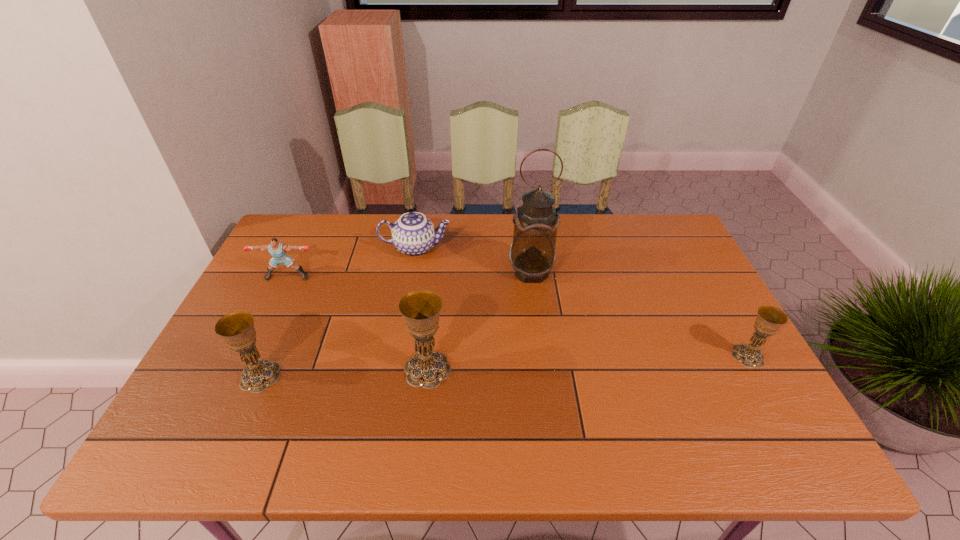
Locate an element on the screen. Image resolution: width=960 pixels, height=540 pixels. free space that is in between the second tallest object and the leftmost chalice is located at coordinates (344, 373).

I want to click on unoccupied area between the tallest object and the tallest chalice, so click(x=479, y=320).

Find the location of a particular element. free spot between the second chalice from right to left and the rightmost object is located at coordinates (588, 362).

Identify the location of unoccupied position between the second object from right to left and the second tallest object. (479, 320).

Identify the location of vacant space in between the puncher and the tallest object. The width and height of the screenshot is (960, 540). (409, 274).

In order to click on unoccupied position between the fifth object from left to right and the shortest chalice in this screenshot , I will do `click(639, 314)`.

Image resolution: width=960 pixels, height=540 pixels. Find the location of `unoccupied position between the leftmost chalice and the chinaware`. unoccupied position between the leftmost chalice and the chinaware is located at coordinates (338, 312).

In order to click on object that stands as the fourth closest to the chinaware in this screenshot , I will do `click(237, 329)`.

Identify the location of object that can be found as the closest to the tallest chalice. This screenshot has width=960, height=540. (532, 254).

Locate which chalice is the second closest to the fifth object from left to right. Please provide its 2D coordinates. Your answer should be formatted as a tuple, i.e. [(x, y)], where the tuple contains the x and y coordinates of a point satisfying the conditions above.

[(769, 319)]